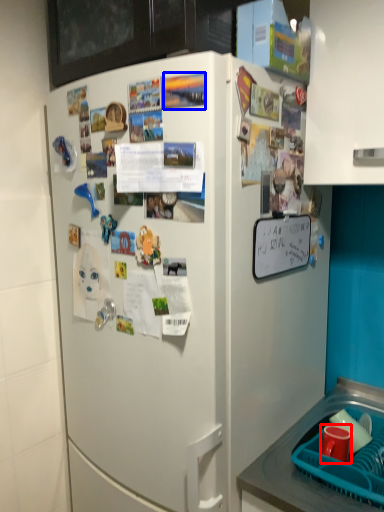
Question: Among these objects, which one is nearest to the camera, coffee cup (highlighted by a red box) or poster (highlighted by a blue box)?

Choices:
 (A) coffee cup
 (B) poster

Answer: (B)